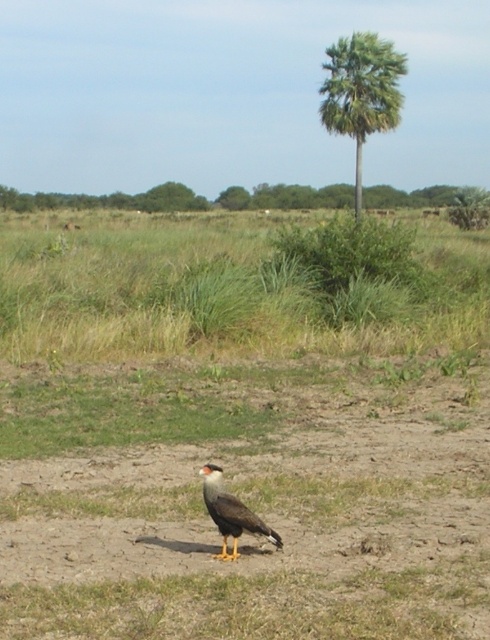
Question: Which of the following is the farthest from the observer?

Choices:
 (A) (372, 108)
 (B) (256, 522)

Answer: (A)

Question: Can you confirm if green leafy tree at upper center is positioned below brown feathered eagle at center?

Choices:
 (A) no
 (B) yes

Answer: (A)

Question: Can you confirm if green leafy palm at upper center is positioned below brown feathered eagle at center?

Choices:
 (A) no
 (B) yes

Answer: (A)

Question: Considering the real-world distances, which object is closest to the brown feathered eagle at center?

Choices:
 (A) brown dirt field at center
 (B) green leafy palm at upper center
 (C) green leafy tree at upper center

Answer: (A)

Question: Considering the real-world distances, which object is closest to the green leafy palm at upper center?

Choices:
 (A) brown dirt field at center
 (B) brown feathered eagle at center

Answer: (A)

Question: Observing the image, what is the correct spatial positioning of brown dirt field at center in reference to brown feathered eagle at center?

Choices:
 (A) below
 (B) above

Answer: (B)